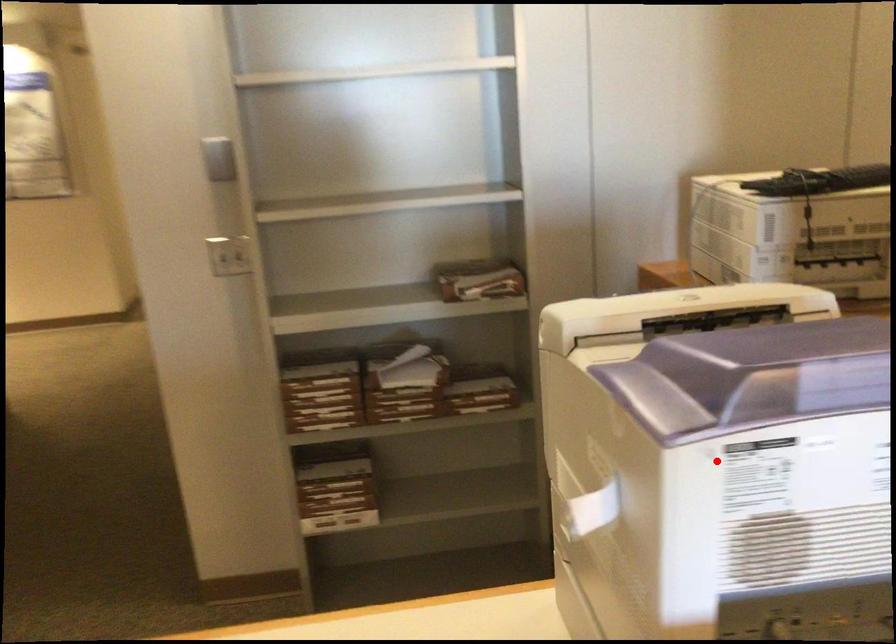
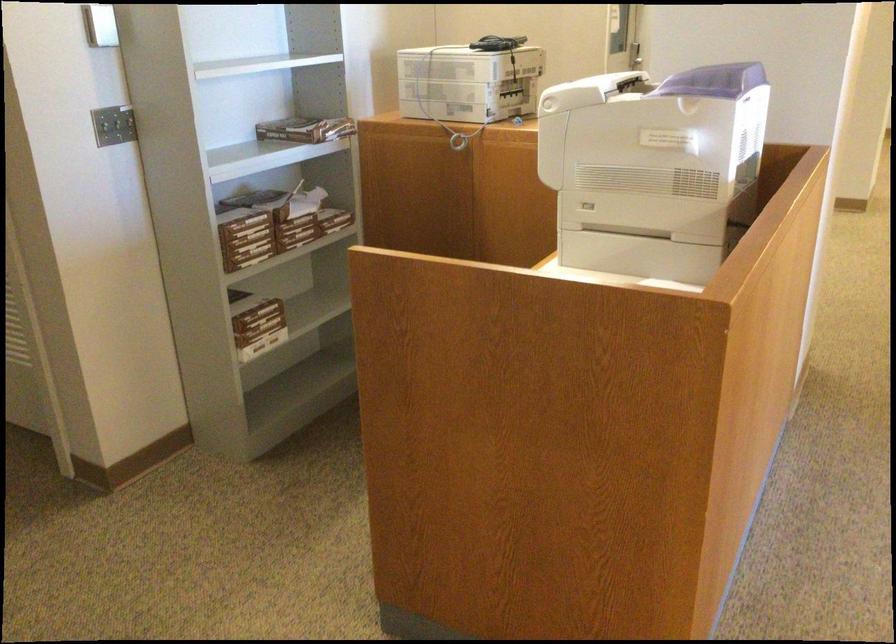
Locate, in the second image, the point that corresponds to the highlighted location in the first image.

(714, 80)